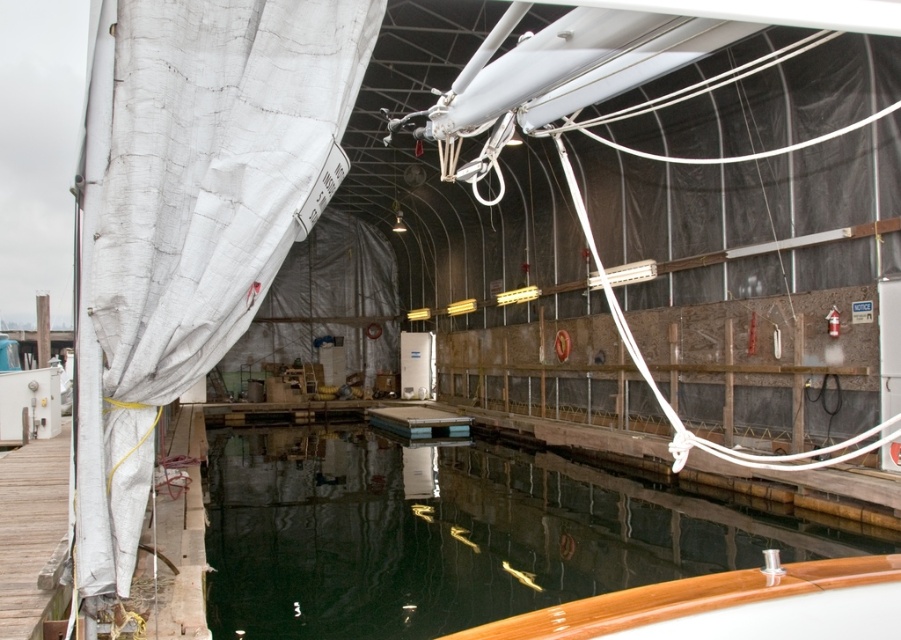
You are standing inside the boat maintenance facility and notice the white fabric curtain at left and the dark reflective water at center. Which object is located above the other?

The white fabric curtain at left is positioned over the dark reflective water at center, so it is located above the water.

You are standing in the boat maintenance facility and want to know where the dark reflective water at center is located. Can you describe its position using coordinates?

The dark reflective water at center is located at coordinates point (447, 534).